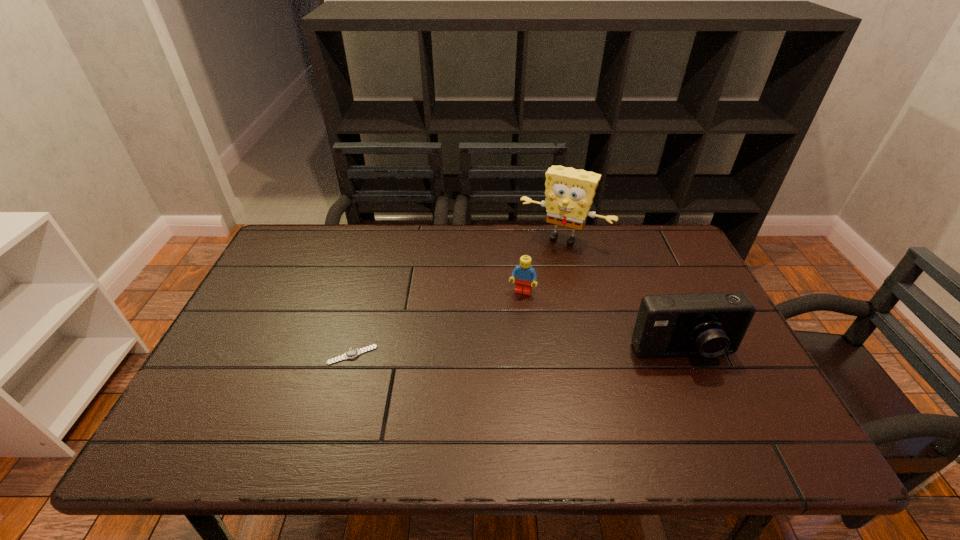
Identify the location of vacant point located between the leftmost object and the second farthest object. (437, 323).

The height and width of the screenshot is (540, 960). I want to click on free space that is in between the tallest object and the second farthest object, so click(542, 265).

Where is `object that ranks as the second closest to the tallest object`? object that ranks as the second closest to the tallest object is located at coordinates (709, 324).

You are a GUI agent. You are given a task and a screenshot of the screen. Output one action in this format:
    pyautogui.click(x=<x>, y=<y>)
    Task: Click on the object that stands as the second closest to the third shortest object
    The image size is (960, 540).
    Given the screenshot: What is the action you would take?
    pyautogui.click(x=569, y=193)

You are a GUI agent. You are given a task and a screenshot of the screen. Output one action in this format:
    pyautogui.click(x=<x>, y=<y>)
    Task: Click on the vacant region that satisfies the following two spatial constraints: 1. on the back side of the leftmost object; 2. on the right side of the sponge
    This screenshot has width=960, height=540.
    Given the screenshot: What is the action you would take?
    (385, 238)